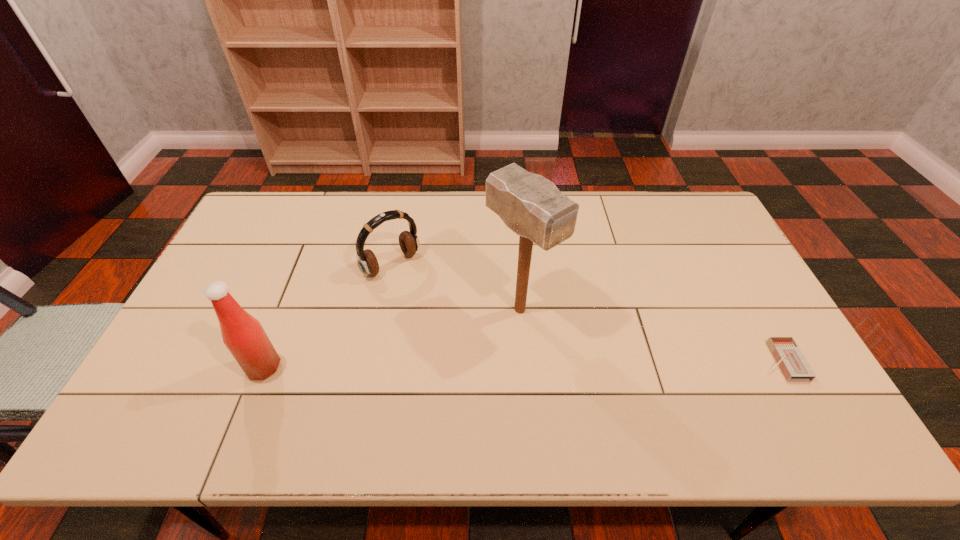
The image size is (960, 540). What are the coordinates of `vacant point located between the third object from left to right and the rightmost object` in the screenshot? It's located at (650, 335).

Identify the location of vacant area that lies between the tallest object and the second shortest object. (456, 287).

Where is `vacant area that lies between the leftmost object and the second object from left to right`? vacant area that lies between the leftmost object and the second object from left to right is located at coordinates (327, 316).

Locate an element on the screen. The image size is (960, 540). free space between the tallest object and the rightmost object is located at coordinates (650, 335).

Identify the location of vacant region between the matchbox and the tallest object. (650, 335).

You are a GUI agent. You are given a task and a screenshot of the screen. Output one action in this format:
    pyautogui.click(x=<x>, y=<y>)
    Task: Click on the free space between the tallest object and the shortest object
    The height and width of the screenshot is (540, 960).
    Given the screenshot: What is the action you would take?
    pyautogui.click(x=650, y=335)

At what (x,y) coordinates should I click in order to perform the action: click on free area in between the mallet and the leftmost object. Please return your answer as a coordinate pair (x, y). Looking at the image, I should click on (392, 339).

This screenshot has width=960, height=540. Find the location of `free spot between the second object from left to right and the second tallest object`. free spot between the second object from left to right and the second tallest object is located at coordinates pos(327,316).

I want to click on vacant area that lies between the rightmost object and the second shortest object, so point(586,313).

Point out which object is positioned as the second nearest to the shortest object. Please provide its 2D coordinates. Your answer should be formatted as a tuple, i.e. [(x, y)], where the tuple contains the x and y coordinates of a point satisfying the conditions above.

[(367, 262)]